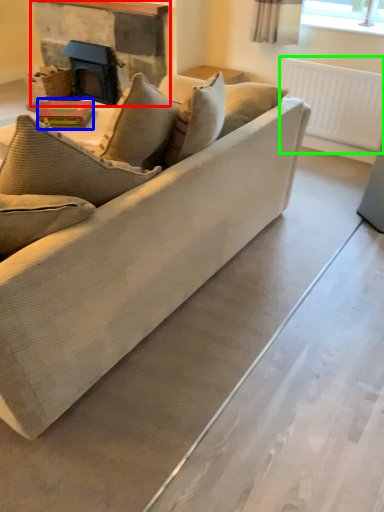
Question: Based on their relative distances, which object is nearer to fireplace (highlighted by a red box)? Choose from book (highlighted by a blue box) and radiator (highlighted by a green box).

Choices:
 (A) book
 (B) radiator

Answer: (A)